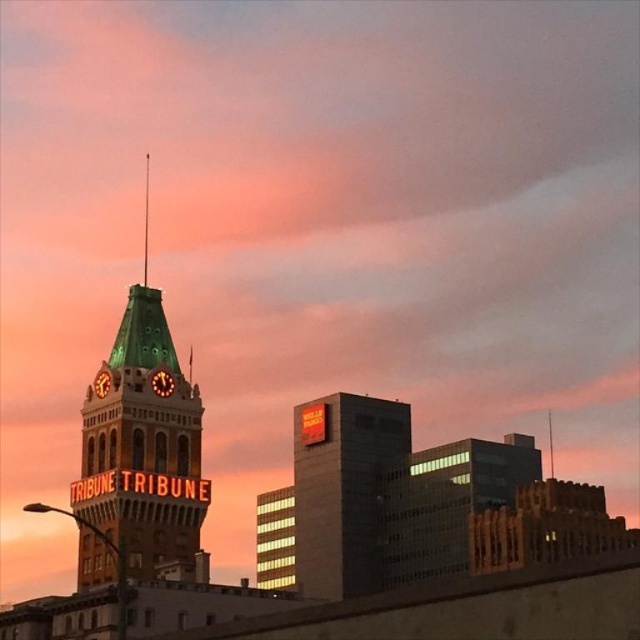
Identify the location of matte orange sign at center. This screenshot has width=640, height=640. (342, 488).

Which is behind, point (384, 413) or point (168, 392)?

Positioned behind is point (384, 413).

Does point (301, 477) come closer to viewer compared to point (170, 374)?

That is False.

I want to click on matte orange sign at center, so click(342, 488).

Is green copper clock tower at upper left in front of matte green clock tower at upper left?

Yes, green copper clock tower at upper left is in front of matte green clock tower at upper left.

Find the location of a particular element. Image resolution: width=640 pixels, height=640 pixels. green copper clock tower at upper left is located at coordinates (140, 451).

Looking at this image, who is more distant from viewer, (308, 406) or (93, 381)?

Positioned behind is point (308, 406).

The height and width of the screenshot is (640, 640). What do you see at coordinates (342, 488) in the screenshot? I see `matte orange sign at center` at bounding box center [342, 488].

This screenshot has height=640, width=640. In order to click on matte orange sign at center in this screenshot , I will do `click(342, 488)`.